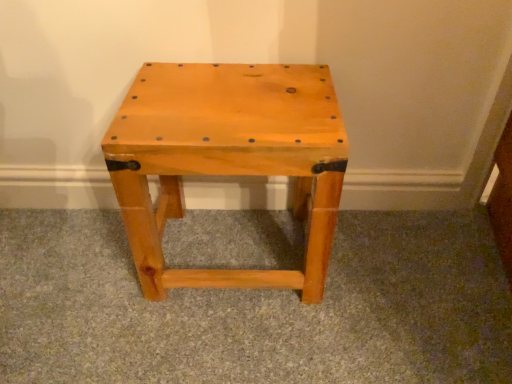
The image size is (512, 384). Identify the location of free spot below natural wood stool at center (from a real-world perspective). (230, 236).